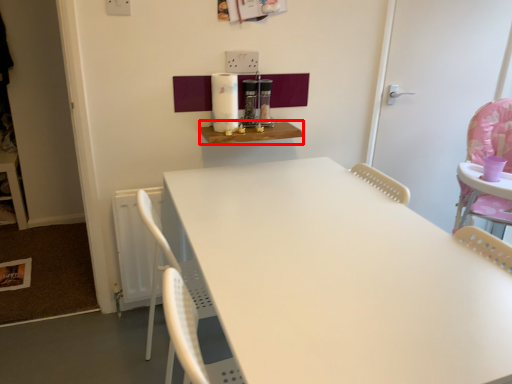
Question: From the image's perspective, what is the correct spatial positioning of table (annotated by the red box) in reference to door?

Choices:
 (A) below
 (B) above

Answer: (A)